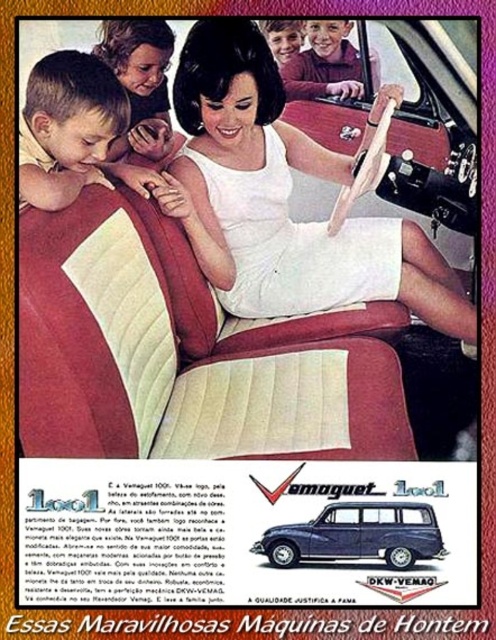
Question: Which of these objects is positioned farthest from the light brown hair at upper left?

Choices:
 (A) light brown hair at upper center
 (B) blue metallic station wagon at center
 (C) white satin dress at center
 (D) light brown hair at left

Answer: (B)

Question: Which object is closer to the camera taking this photo?

Choices:
 (A) light brown hair at upper left
 (B) light brown hair at upper center

Answer: (A)

Question: Can you confirm if blue metallic station wagon at center is smaller than light brown hair at upper center?

Choices:
 (A) no
 (B) yes

Answer: (B)

Question: Considering the relative positions of blue metallic station wagon at center and light brown hair at upper left in the image provided, where is blue metallic station wagon at center located with respect to light brown hair at upper left?

Choices:
 (A) below
 (B) above

Answer: (A)

Question: Is blue metallic station wagon at center closer to the viewer compared to light brown hair at upper left?

Choices:
 (A) yes
 (B) no

Answer: (A)

Question: Which object is closer to the camera taking this photo?

Choices:
 (A) light brown hair at left
 (B) blue metallic station wagon at center

Answer: (A)